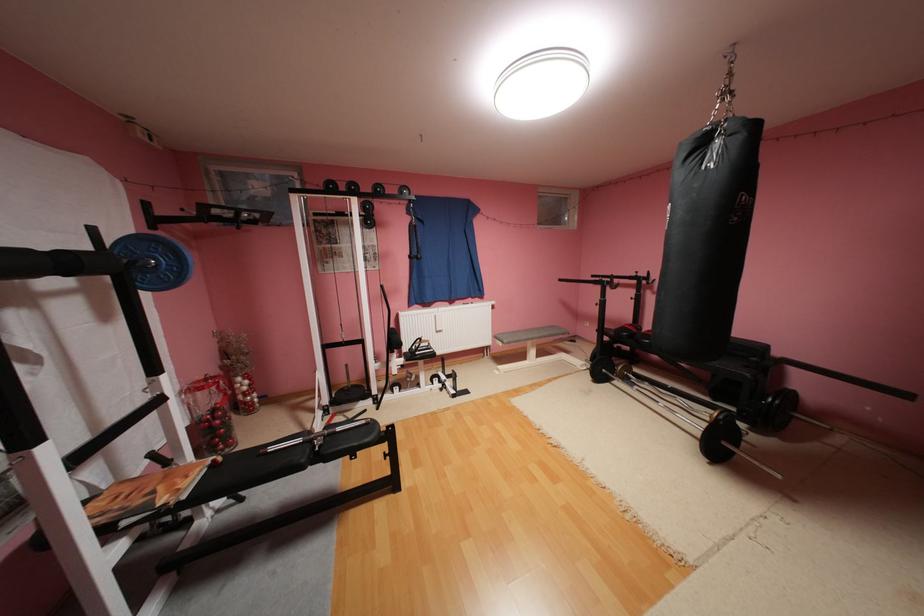
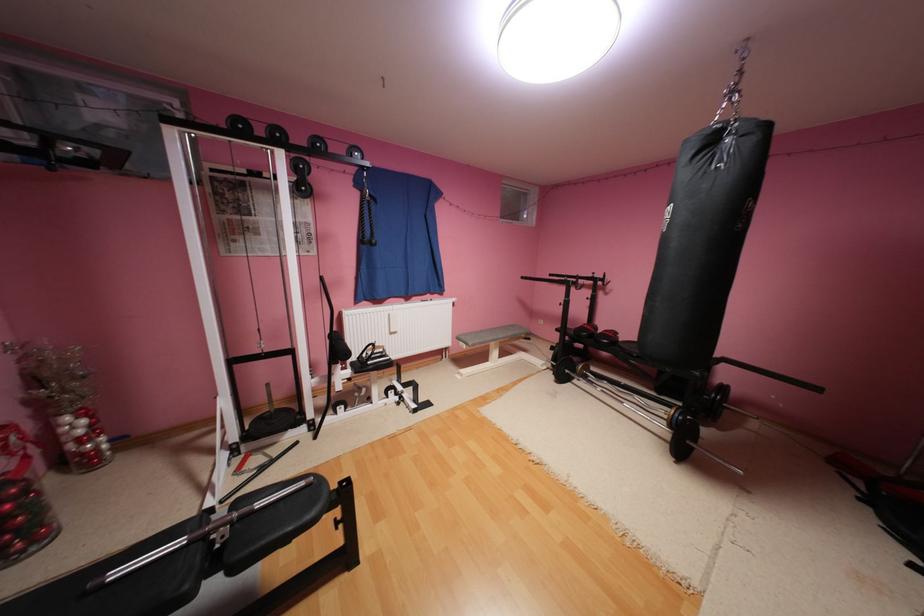
The images are taken continuously from a first-person perspective. In which direction are you moving?

The cameraman moved toward left, forward.